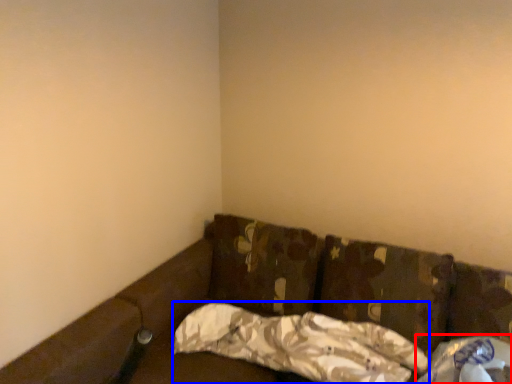
Question: Which point is further to the camera, material (highlighted by a red box) or pillow (highlighted by a blue box)?

Choices:
 (A) material
 (B) pillow

Answer: (B)